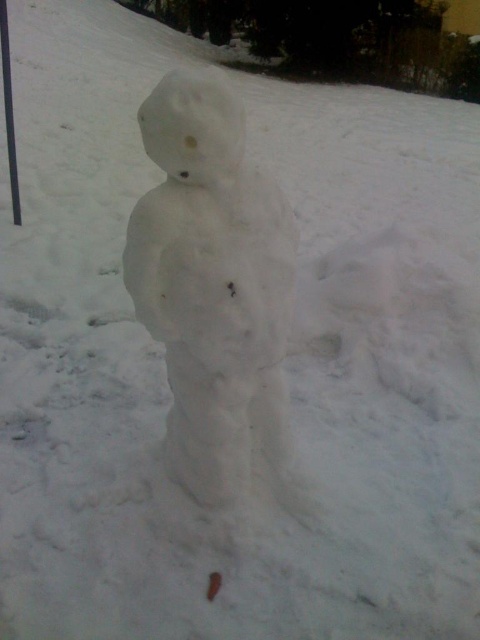
Question: Does white fluffy snowman at center come behind white snowman at center?

Choices:
 (A) yes
 (B) no

Answer: (B)

Question: Which object is closer to the camera taking this photo?

Choices:
 (A) white fluffy snowman at center
 (B) white snowman at center

Answer: (A)

Question: Among these points, which one is farthest from the camera?

Choices:
 (A) (9, 83)
 (B) (216, 484)

Answer: (A)

Question: Does white fluffy snowman at center come in front of white snowman at center?

Choices:
 (A) yes
 (B) no

Answer: (A)

Question: Does white fluffy snowman at center appear under white snowman at center?

Choices:
 (A) no
 (B) yes

Answer: (B)

Question: Which object is farther from the camera taking this photo?

Choices:
 (A) white fluffy snowman at center
 (B) white snowman at center

Answer: (B)